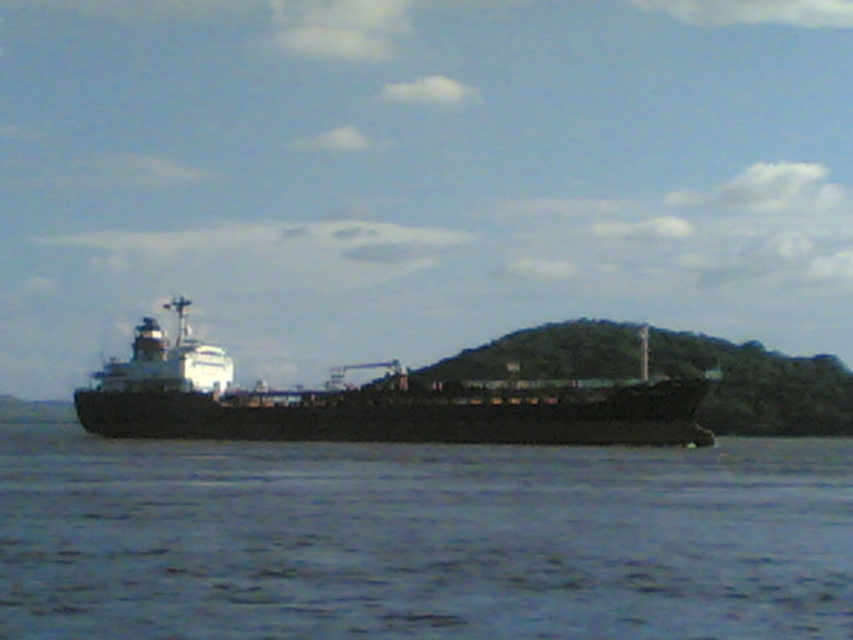
Does blue water at lower center have a lesser height compared to black matte ship at center?

Yes, blue water at lower center is shorter than black matte ship at center.

Does blue water at lower center have a greater height compared to black matte ship at center?

No.

This screenshot has height=640, width=853. Describe the element at coordinates (421, 540) in the screenshot. I see `blue water at lower center` at that location.

You are a GUI agent. You are given a task and a screenshot of the screen. Output one action in this format:
    pyautogui.click(x=<x>, y=<y>)
    Task: Click on the blue water at lower center
    
    Given the screenshot: What is the action you would take?
    pyautogui.click(x=421, y=540)